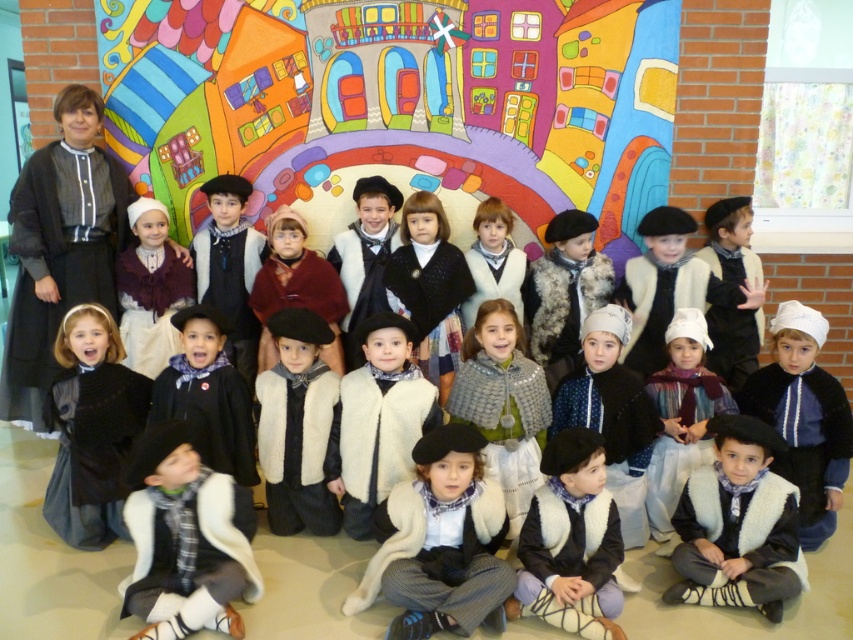
Between white woolen vest at lower left and black velvet dress at center, which one is positioned lower?

white woolen vest at lower left is below.

Which is in front, point (247, 593) or point (134, 413)?

Point (247, 593) is more forward.

Locate an element on the screen. The image size is (853, 640). white woolen vest at lower left is located at coordinates (186, 540).

The height and width of the screenshot is (640, 853). What are the coordinates of `black velvet dress at center` in the screenshot? It's located at (91, 428).

Does black velvet dress at center have a larger size compared to matte white dress at center?

Correct, black velvet dress at center is larger in size than matte white dress at center.

Locate an element on the screen. black velvet dress at center is located at coordinates (91, 428).

Does white woolen vest at center have a smaller size compared to black velvet dress at center?

No.

Who is more forward, (459,452) or (68,362)?

Point (459,452) is more forward.

Image resolution: width=853 pixels, height=640 pixels. Identify the location of white woolen vest at center. point(445,540).